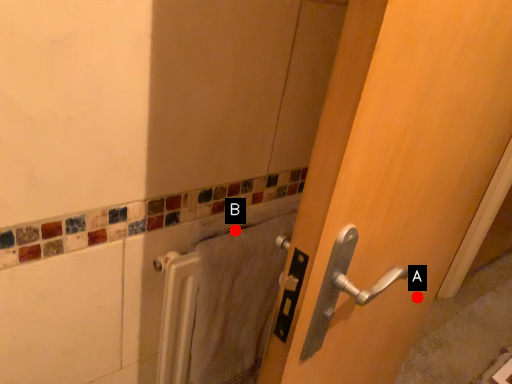
Question: Two points are circled on the image, labeled by A and B beside each circle. Which of the following is the farthest from the observer?

Choices:
 (A) A is further
 (B) B is further

Answer: (A)